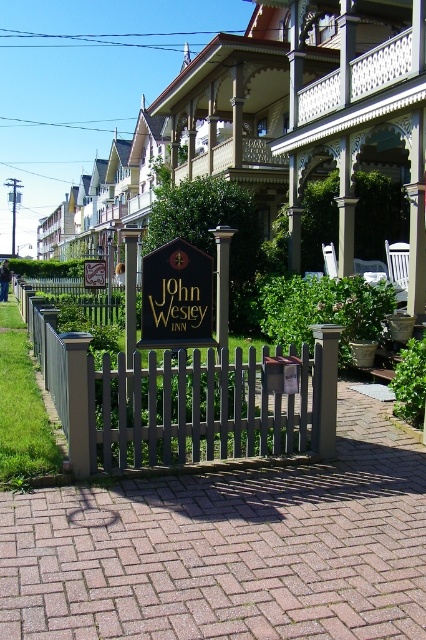
Does gray wood picket fence at center have a larger size compared to brown wood post at center?

No.

Can you confirm if gray wood picket fence at center is positioned above brown wood post at center?

Actually, gray wood picket fence at center is below brown wood post at center.

Does point (57, 337) lie in front of point (83, 470)?

No, (57, 337) is further to viewer.

Identify the location of gray wood picket fence at center. (181, 400).

How far apart are brown wood post at center and goldmaterial/texturesign at center?

A distance of 39.43 feet exists between brown wood post at center and goldmaterial/texturesign at center.

Is brown wood post at center wider than goldmaterial/texturesign at center?

No, brown wood post at center is not wider than goldmaterial/texturesign at center.

Which is in front, point (74, 449) or point (100, 269)?

Point (74, 449)

At what (x,y) coordinates should I click in order to perform the action: click on brown wood post at center. Please return your answer as a coordinate pair (x, y). Looking at the image, I should click on coord(77,401).

Consider the image. Is gray wood picket fence at center taller than black wood sign at center?

No.

Does point (331, 385) come farther from viewer compared to point (172, 259)?

No.

The image size is (426, 640). Find the location of `gray wood picket fence at center`. gray wood picket fence at center is located at coordinates (181, 400).